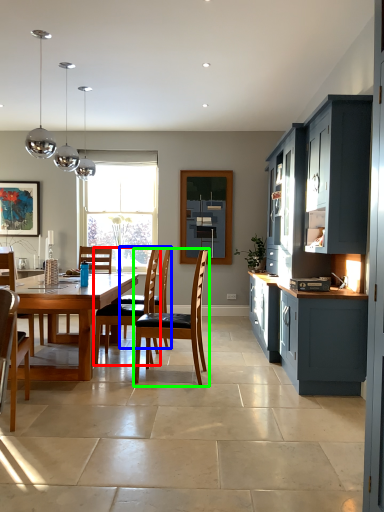
Question: Which object is the closest to the chair (highlighted by a red box)? Choose among these: armchair (highlighted by a blue box) or chair (highlighted by a green box).

Choices:
 (A) armchair
 (B) chair

Answer: (A)